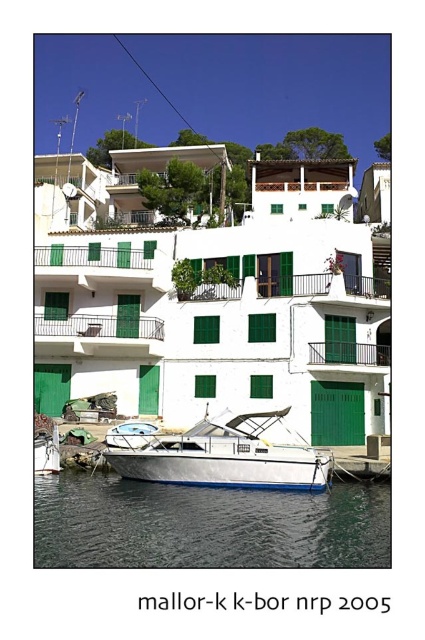
You are standing at the point marked by coordinates point [206,524] in the waterfront scene. What is the immediate surface you are standing on?

The transparent blue water at lower center is represented by point [206,524], so you are standing on transparent blue water at lower center.

You are standing on the green metal balcony at center and want to cross to the other side of the transparent blue water at lower center. Can you step directly across without getting wet?

The transparent blue water at lower center is wider than the green metal balcony at center, so stepping directly across without getting wet is not possible.

You are a tourist visiting Mallorca and want to take a photo of the white glossy boat at lower center and the green metal balcony at center. Which object should you focus on first if you want to capture both in one frame without moving the camera?

You should focus on the white glossy boat at lower center first because it is larger in size than the green metal balcony at center, making it a more prominent subject to center the frame around.